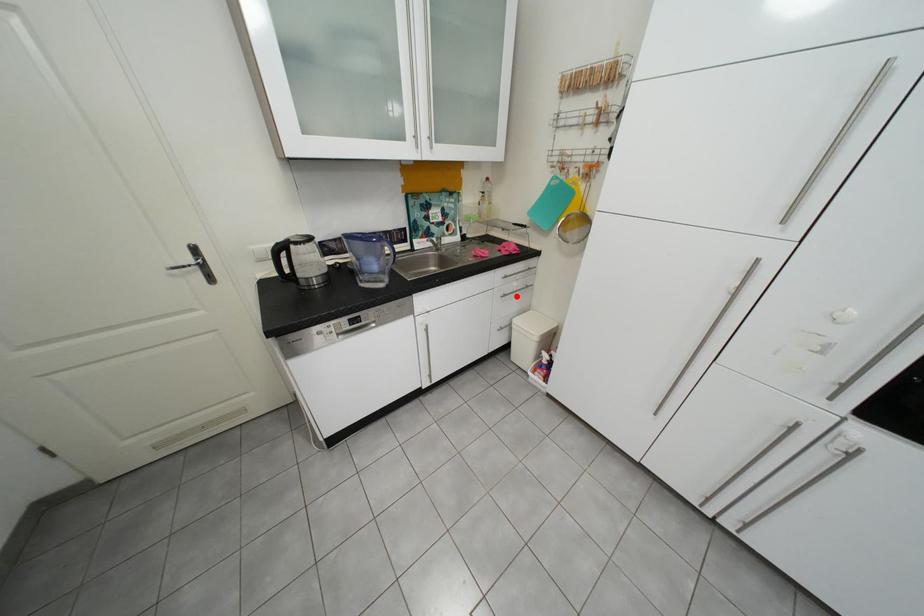
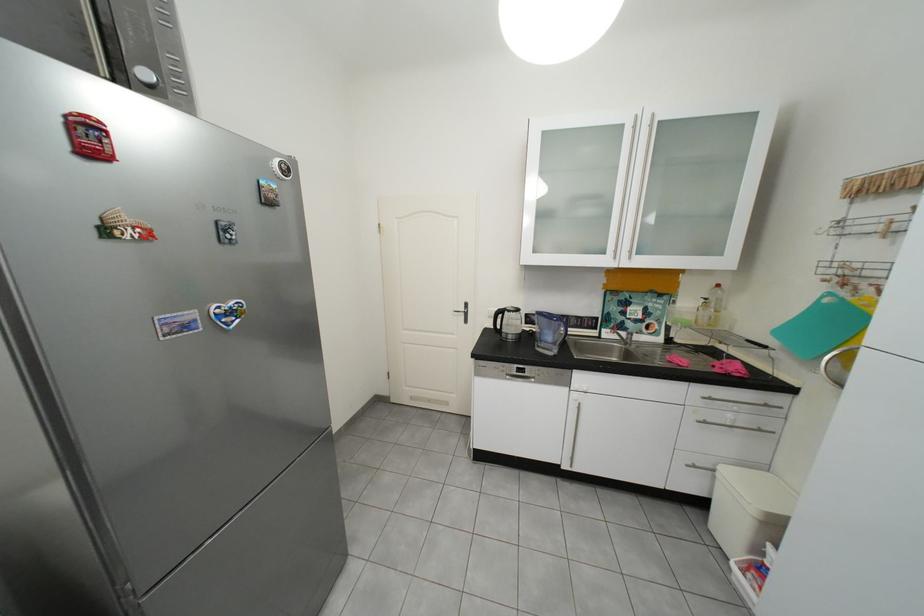
Locate, in the second image, the point that corresponds to the highlighted location in the first image.

(718, 424)